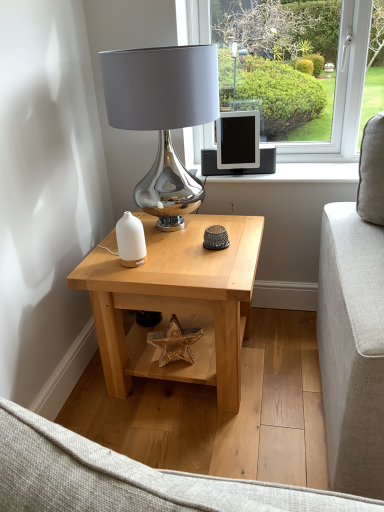
The image size is (384, 512). In order to click on vacant space situated above natural wood table at center (from a real-world perspective) in this screenshot , I will do 180,250.